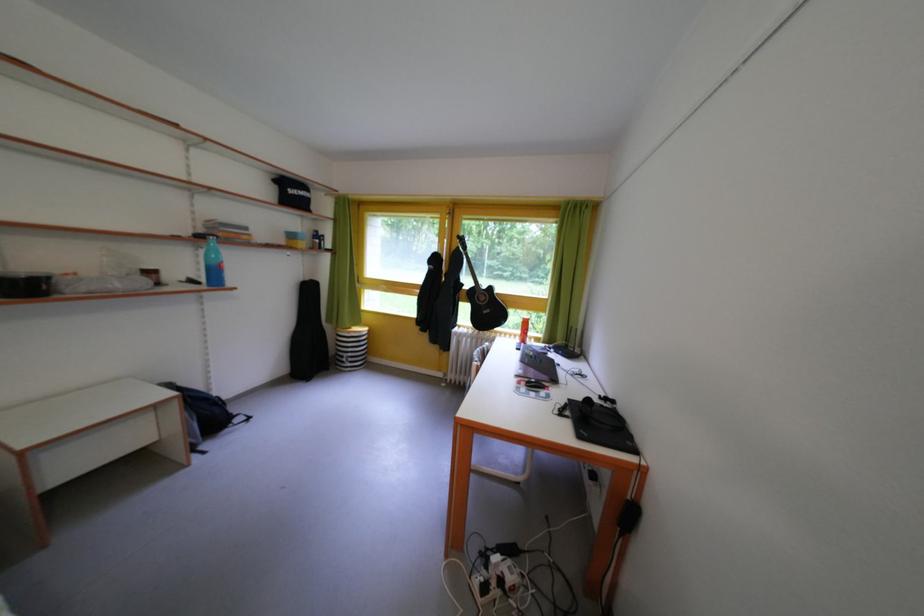
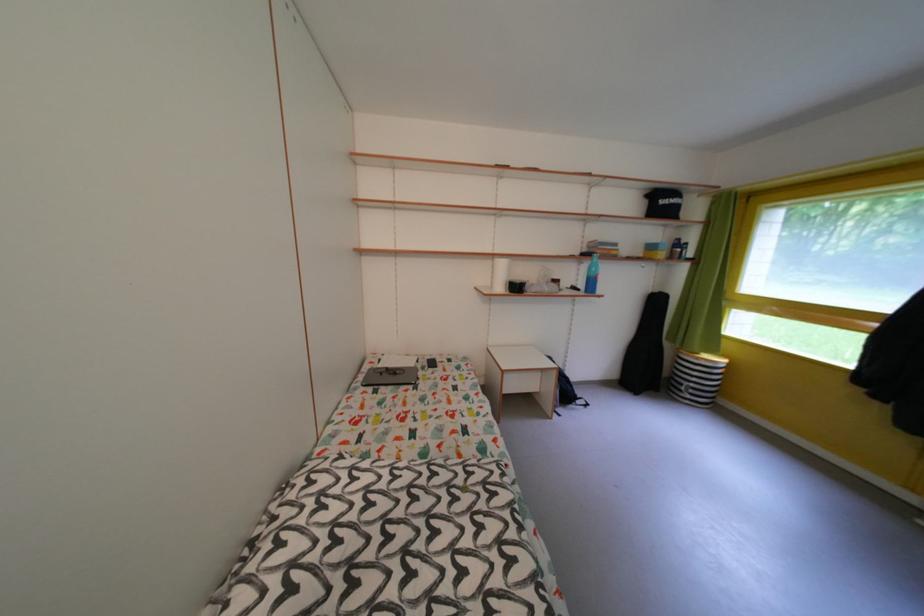
Find the pixel in the second image that matches point 318,285 in the first image.

(665, 296)